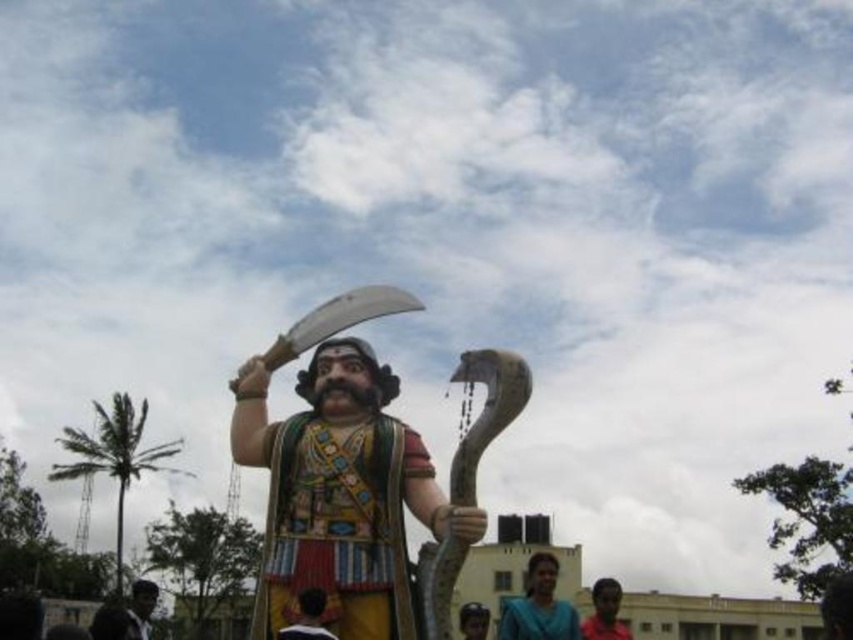
Question: Is shiny silver ax at upper center further to camera compared to dark skin human at lower right?

Choices:
 (A) no
 (B) yes

Answer: (A)

Question: Which of the following is the farthest from the observer?

Choices:
 (A) dark skin human at lower right
 (B) blue fabric saree at lower center
 (C) polished wood statue at center

Answer: (A)

Question: Which object is farther from the camera taking this photo?

Choices:
 (A) blue fabric saree at lower center
 (B) smooth brown hair at center
 (C) dark brown leather cap at lower left

Answer: (C)

Question: Which object is farther from the camera taking this photo?

Choices:
 (A) dark skin human at lower right
 (B) dark brown leather cap at lower left
 (C) polished wood statue at center

Answer: (A)

Question: Is dark skin human at lower right bigger than dark brown leather cap at lower left?

Choices:
 (A) no
 (B) yes

Answer: (A)

Question: Where is polished wood statue at center located in relation to dark skin human at lower right in the image?

Choices:
 (A) below
 (B) above

Answer: (B)